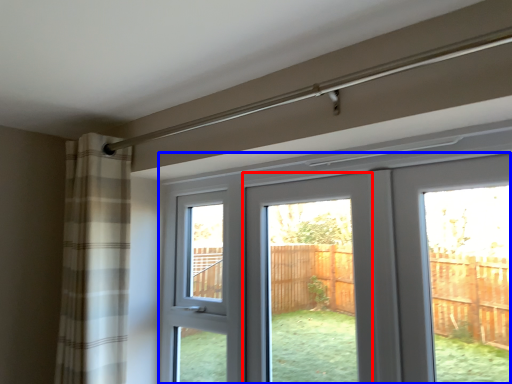
Question: Among these objects, which one is farthest to the camera, screen door (highlighted by a red box) or door (highlighted by a blue box)?

Choices:
 (A) screen door
 (B) door

Answer: (A)